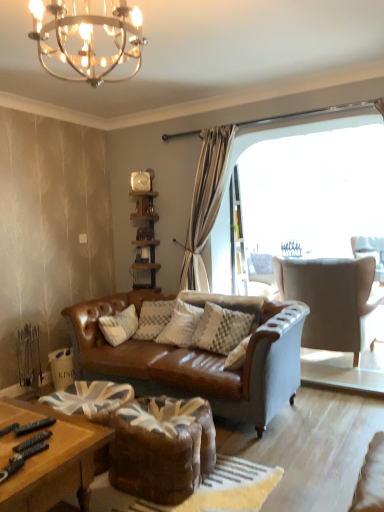
Question: From the image's perspective, is woodenshelf at center located beneath leather swivel chair at center?

Choices:
 (A) no
 (B) yes

Answer: (A)

Question: Is woodenshelf at center facing away from leather swivel chair at center?

Choices:
 (A) no
 (B) yes

Answer: (A)

Question: Can we say woodenshelf at center lies outside leather swivel chair at center?

Choices:
 (A) yes
 (B) no

Answer: (A)

Question: Can you confirm if woodenshelf at center is wider than leather swivel chair at center?

Choices:
 (A) yes
 (B) no

Answer: (B)

Question: Is woodenshelf at center placed right next to leather swivel chair at center?

Choices:
 (A) no
 (B) yes

Answer: (A)

Question: Does point (112, 30) appear closer or farther from the camera than point (145, 274)?

Choices:
 (A) farther
 (B) closer

Answer: (B)

Question: From the image's perspective, is metallic chandelier at upper center above or below woodenshelf at center?

Choices:
 (A) below
 (B) above

Answer: (B)

Question: From a real-world perspective, is metallic chandelier at upper center positioned above or below woodenshelf at center?

Choices:
 (A) above
 (B) below

Answer: (A)

Question: Is metallic chandelier at upper center taller or shorter than woodenshelf at center?

Choices:
 (A) tall
 (B) short

Answer: (B)

Question: Is metallic chandelier at upper center taller or shorter than leather swivel chair at center?

Choices:
 (A) short
 (B) tall

Answer: (B)

Question: Visually, is metallic chandelier at upper center positioned to the left or to the right of leather swivel chair at center?

Choices:
 (A) left
 (B) right

Answer: (A)

Question: Is metallic chandelier at upper center situated inside leather swivel chair at center or outside?

Choices:
 (A) inside
 (B) outside

Answer: (B)

Question: Based on their sizes in the image, would you say metallic chandelier at upper center is bigger or smaller than leather swivel chair at center?

Choices:
 (A) big
 (B) small

Answer: (B)

Question: Would you say suede-like beige armchair at right is inside or outside woodenshelf at center?

Choices:
 (A) inside
 (B) outside

Answer: (B)

Question: Looking at the image, does suede-like beige armchair at right seem bigger or smaller compared to woodenshelf at center?

Choices:
 (A) small
 (B) big

Answer: (B)